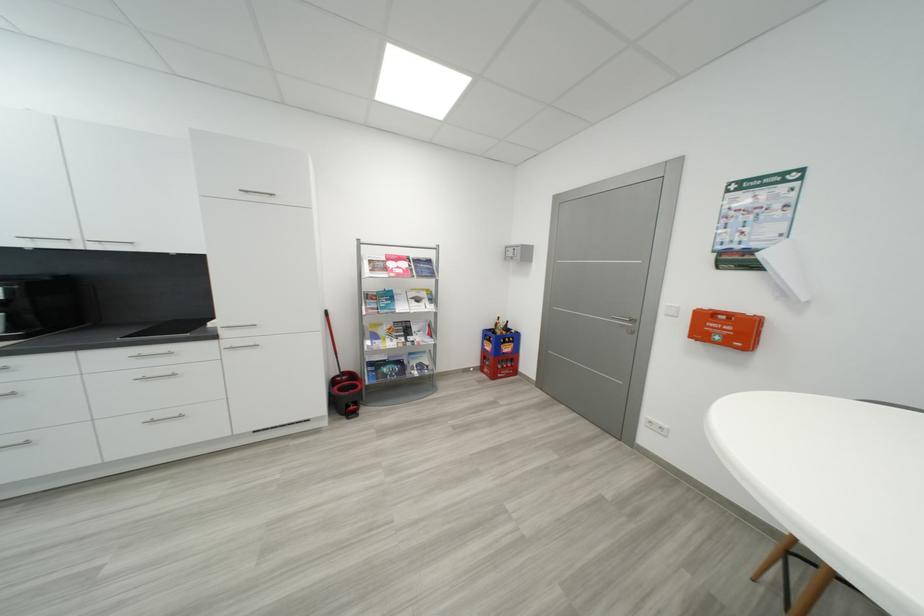
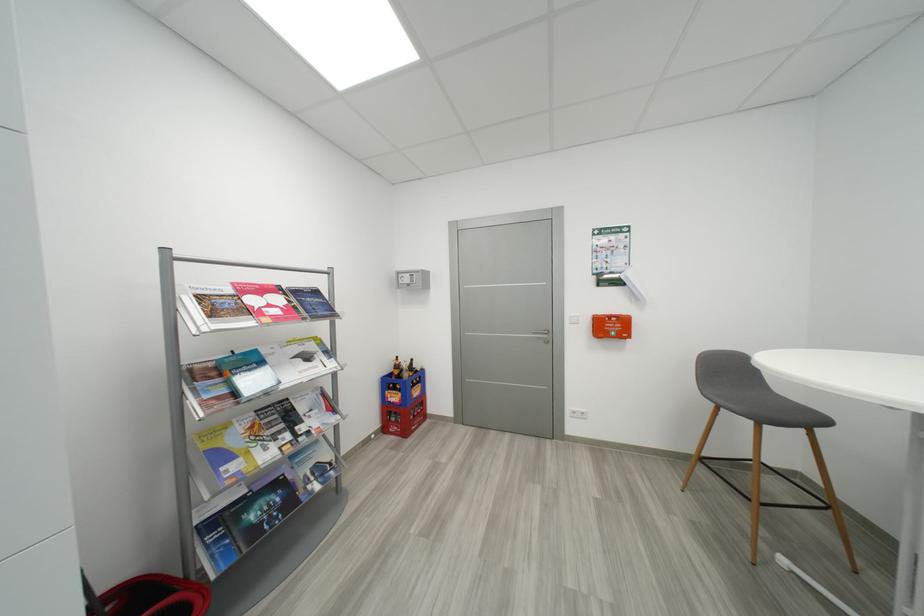
Where in the second image is the point corresponding to (489,370) from the first image?

(392, 431)